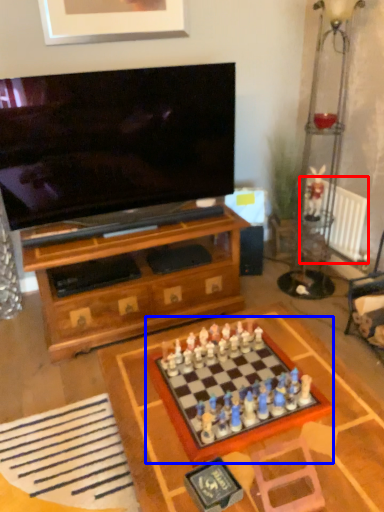
Question: Which point is closer to the camera, radiator (highlighted by a red box) or board game (highlighted by a blue box)?

Choices:
 (A) radiator
 (B) board game

Answer: (B)